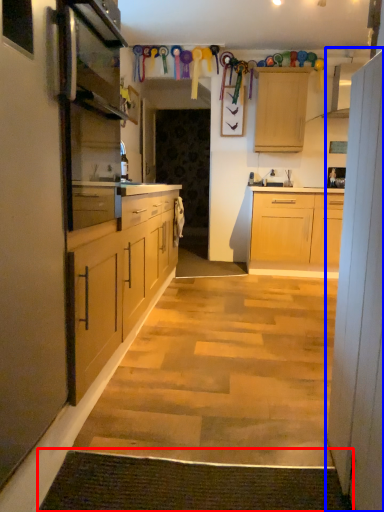
Question: Which object appears closest to the camera in this image, doormat (highlighted by a red box) or cabinet (highlighted by a blue box)?

Choices:
 (A) doormat
 (B) cabinet

Answer: (B)